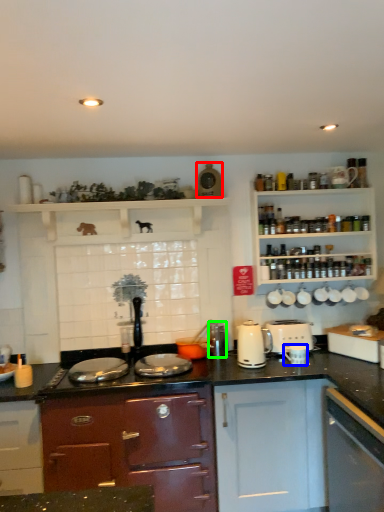
Question: Based on their relative distances, which object is nearer to appliance (highlighted by a red box)? Choose from appliance (highlighted by a blue box) and appliance (highlighted by a green box).

Choices:
 (A) appliance
 (B) appliance

Answer: (B)